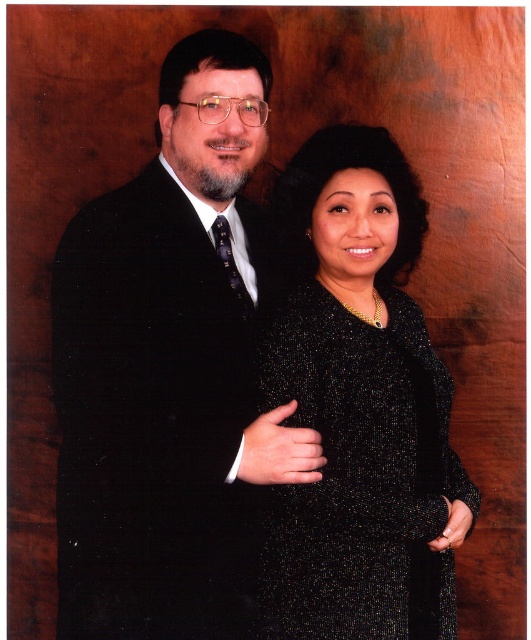
Based on the photo, you are a photographer standing 1.5 meters away from the camera. You want to take a photo of the scene but need to ensure you are not in the frame. Is your current position behind the point at coordinates point (x=225, y=584)? Please explain.

The distance of point (x=225, y=584) from the camera is 1.37 meters. Since you are standing 1.5 meters away from the camera, you are behind the point (x=225, y=584) and thus outside the frame.

You are a photographer setting up for a photoshoot. You need to adjust the lighting so that both the matte black suit at left and the black sequined dress at center are well illuminated. However, the dress is reflecting more light. Which object should you focus the lighting on to ensure both are properly lit?

The matte black suit at left is positioned over the black sequined dress at center. Since the dress reflects more light, you should focus the lighting on the matte black suit at left to balance the illumination between both objects.